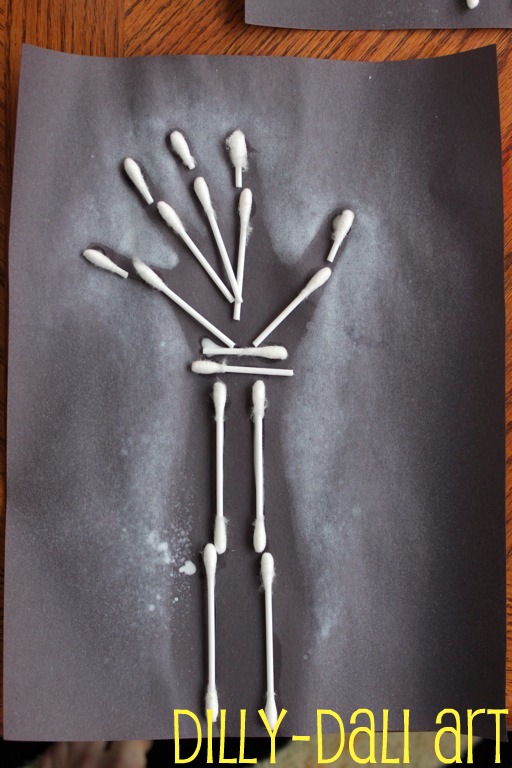
Identify the location of cotton swabs (unbroken). This screenshot has height=768, width=512. (218, 457), (260, 492), (209, 610), (269, 627).